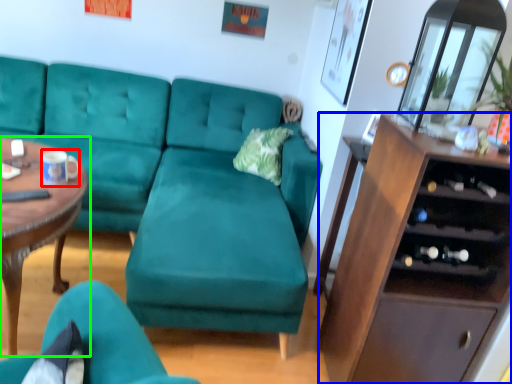
Question: Estimate the real-world distances between objects in this image. Which object is farther from coffee cup (highlighted by a red box), cabinetry (highlighted by a blue box) or coffee table (highlighted by a green box)?

Choices:
 (A) cabinetry
 (B) coffee table

Answer: (A)